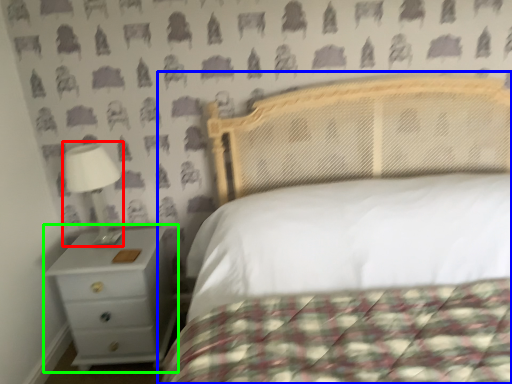
Question: Which object is positioned farthest from lamp (highlighted by a red box)? Select from bed (highlighted by a blue box) and nightstand (highlighted by a green box).

Choices:
 (A) bed
 (B) nightstand

Answer: (A)